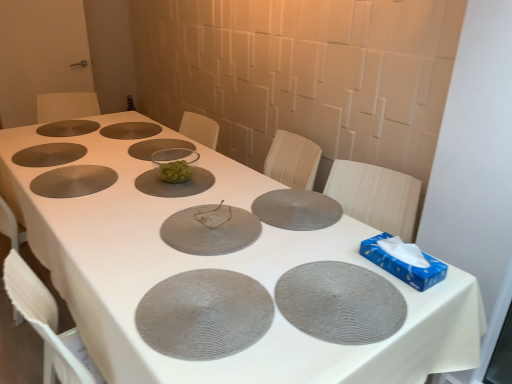
Where is `vacant area that is situated to the right of matte gray glass plate at upper left, placed as the first glass plate when sorted from back to front`? The height and width of the screenshot is (384, 512). vacant area that is situated to the right of matte gray glass plate at upper left, placed as the first glass plate when sorted from back to front is located at coordinates (113, 125).